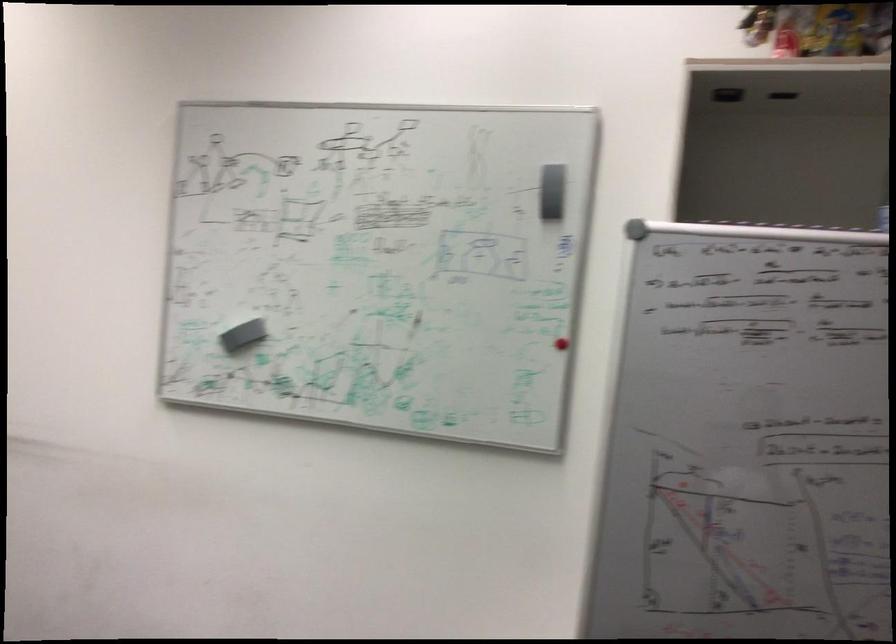
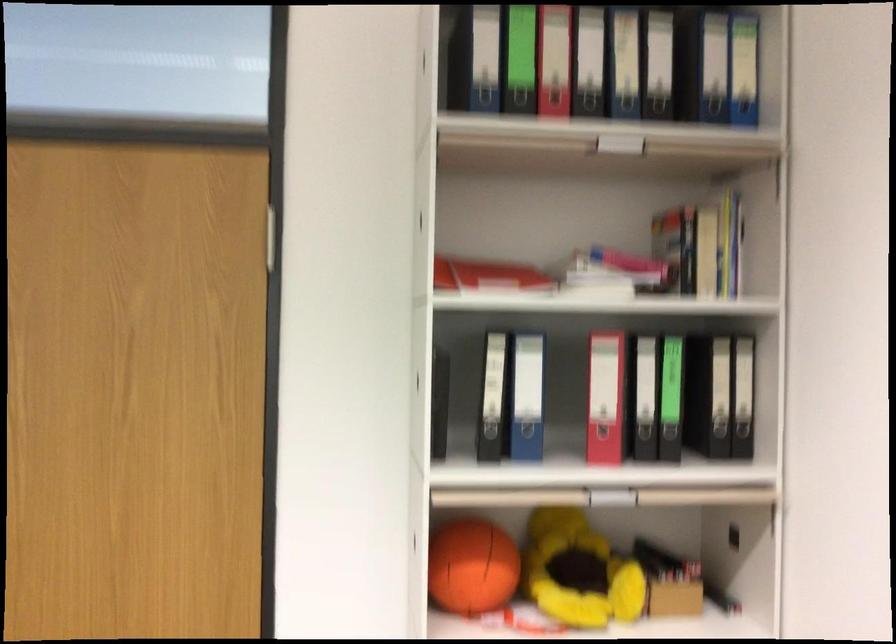
Question: How did the camera likely rotate?

Choices:
 (A) Left
 (B) Right
 (C) Up
 (D) Down

Answer: (B)